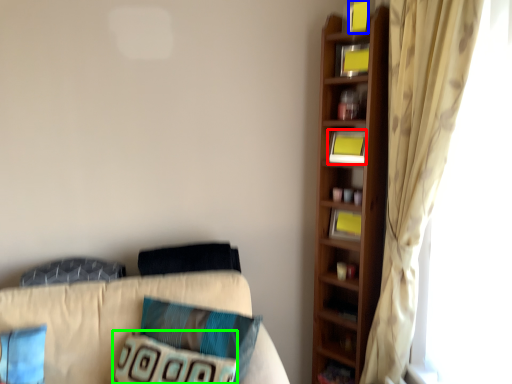
Question: Which object is positioned closest to book (highlighted by a red box)? Select from book (highlighted by a blue box) and pillow (highlighted by a green box).

Choices:
 (A) book
 (B) pillow

Answer: (A)